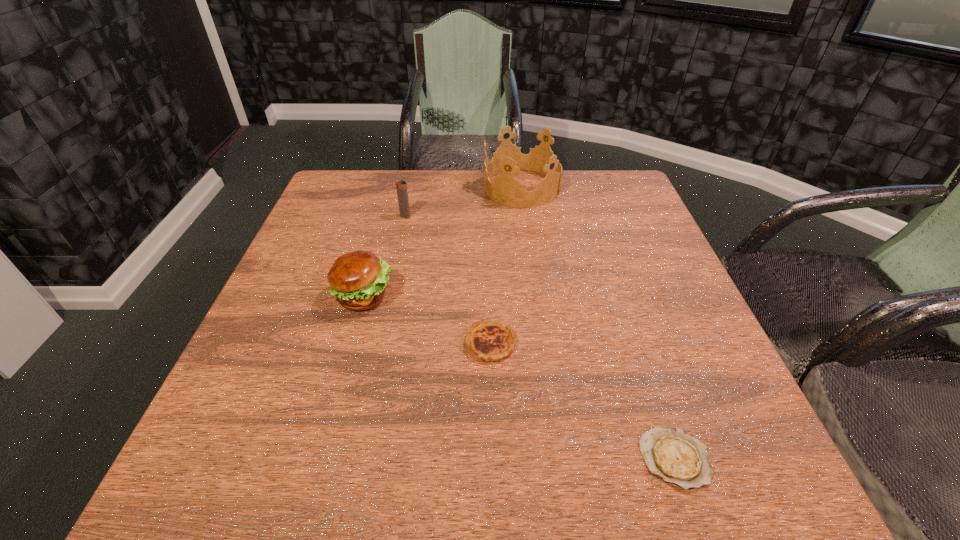
Image resolution: width=960 pixels, height=540 pixels. I want to click on free space between the hamburger and the tallest object, so tap(443, 242).

The image size is (960, 540). In order to click on free space between the left quiche and the tiara in this screenshot , I will do `click(506, 265)`.

This screenshot has height=540, width=960. Identify the location of free space between the rightmost object and the taller quiche. (583, 401).

Locate an element on the screen. The image size is (960, 540). vacant space that is in between the nearer quiche and the igniter is located at coordinates (540, 338).

Locate an element on the screen. free spot between the right quiche and the hamburger is located at coordinates (519, 377).

You are a GUI agent. You are given a task and a screenshot of the screen. Output one action in this format:
    pyautogui.click(x=<x>, y=<y>)
    Task: Click on the vacant space in between the igniter and the third nearest object
    
    Given the screenshot: What is the action you would take?
    pyautogui.click(x=384, y=256)

Locate an element on the screen. This screenshot has height=540, width=960. blank region between the igniter and the shorter quiche is located at coordinates (540, 338).

What are the coordinates of `free space between the second farthest object and the tallest object` in the screenshot? It's located at (464, 202).

Image resolution: width=960 pixels, height=540 pixels. What are the coordinates of `object that is the second closest to the third nearest object` in the screenshot? It's located at (401, 186).

Select which object appears as the fourth closest to the fourth nearest object. Please provide its 2D coordinates. Your answer should be formatted as a tuple, i.e. [(x, y)], where the tuple contains the x and y coordinates of a point satisfying the conditions above.

[(673, 455)]